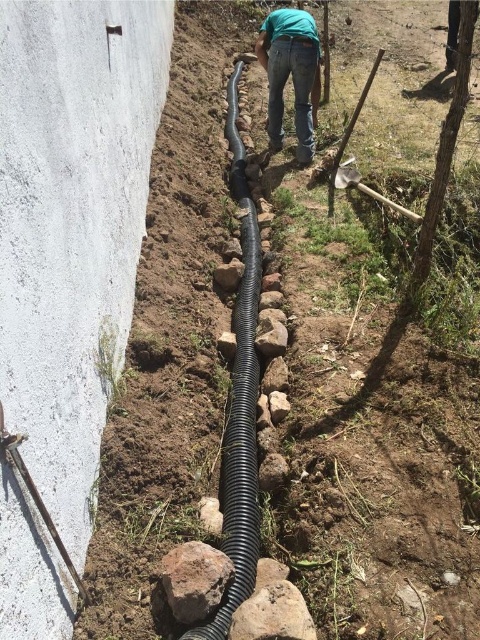
You are standing at the camera position looking at the outdoor scene. There are two points marked in the image, one at coordinate point (x=242, y=323) and another at point (x=188, y=612). Which point is closer to you?

Point (x=242, y=323) is further to the camera than point (x=188, y=612), so the point closer to you is point (x=188, y=612).

You are a construction worker standing at the origin point of the coordinate system in the image. You need to place a new support stone exactly 0.1 units to the right of the black corrugated pipe at center. What are the coordinates where you should place the new stone?

The black corrugated pipe at center is located at coordinates point (240, 403). Adding 0.1 units to the x coordinate gives 0.731, so the new stone should be placed at point (240, 467).

You are a gardener looking at the outdoor scene. You see the black corrugated pipe at center and the green denim jeans at center. Which object is positioned lower in the image?

The black corrugated pipe at center is below green denim jeans at center, so it is positioned lower in the image.